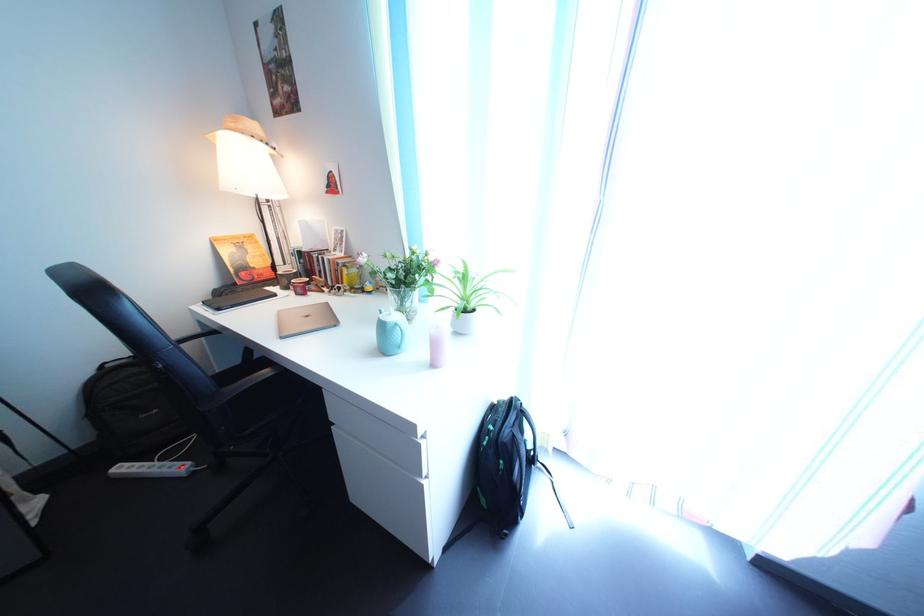
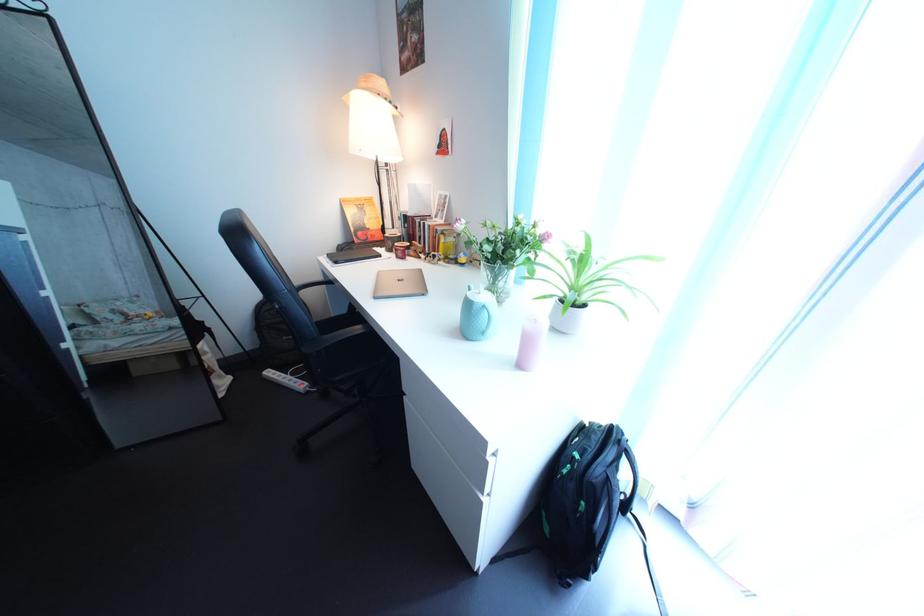
Where in the second image is the point corresponding to (137,477) from the first image?

(284, 381)